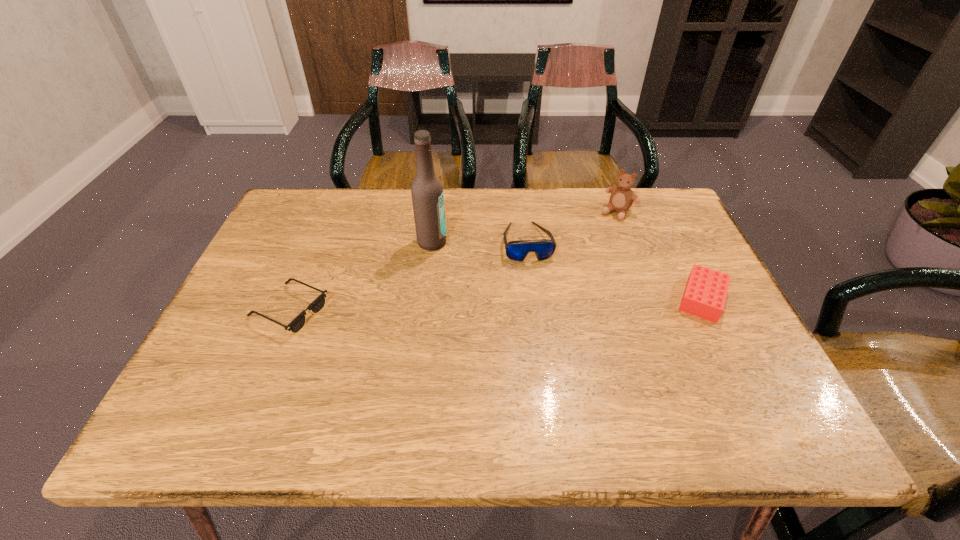
The width and height of the screenshot is (960, 540). I want to click on blank area located on the front-facing side of the third object from right to left, so click(537, 286).

This screenshot has width=960, height=540. What are the coordinates of `beer bottle located in the far edge section of the desktop` in the screenshot? It's located at (427, 194).

Find the location of a particular element. teddy bear that is at the far edge is located at coordinates click(x=621, y=199).

Locate an element on the screen. sunglasses at the far edge is located at coordinates (517, 250).

Locate an element on the screen. The image size is (960, 540). object that is at the left edge is located at coordinates (317, 305).

Where is `Lego present at the right edge`? Image resolution: width=960 pixels, height=540 pixels. Lego present at the right edge is located at coordinates (705, 293).

The width and height of the screenshot is (960, 540). Find the location of `teddy bear that is at the right edge`. teddy bear that is at the right edge is located at coordinates (621, 199).

Find the location of a particular element. Image resolution: width=960 pixels, height=540 pixels. object located in the far right corner section of the desktop is located at coordinates (621, 199).

You are a GUI agent. You are given a task and a screenshot of the screen. Output one action in this format:
    pyautogui.click(x=<x>, y=<y>)
    Task: Click on the free location at the far edge
    The image size is (960, 540).
    Given the screenshot: What is the action you would take?
    pyautogui.click(x=354, y=190)

I want to click on vacant region at the near edge of the desktop, so click(x=518, y=376).